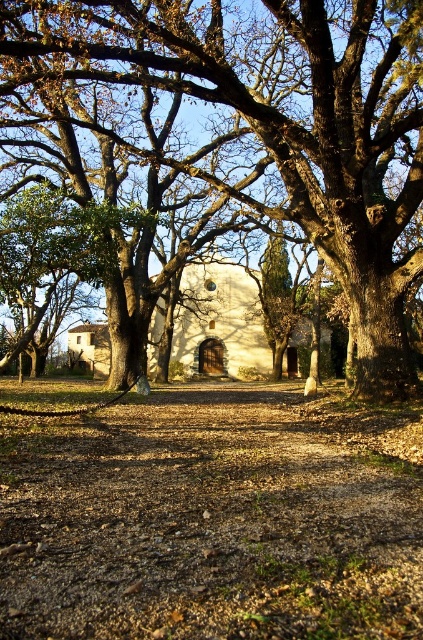
You are an architect designing a new garden layout. You need to place a statue exactly between the smooth brown oak tree at center and the white stucco chapel at center. Which object will the statue be closer to and why?

The statue will be closer to the smooth brown oak tree at center because it is larger in size than the white stucco chapel at center, so the midpoint between them would be nearer to the smaller chapel.